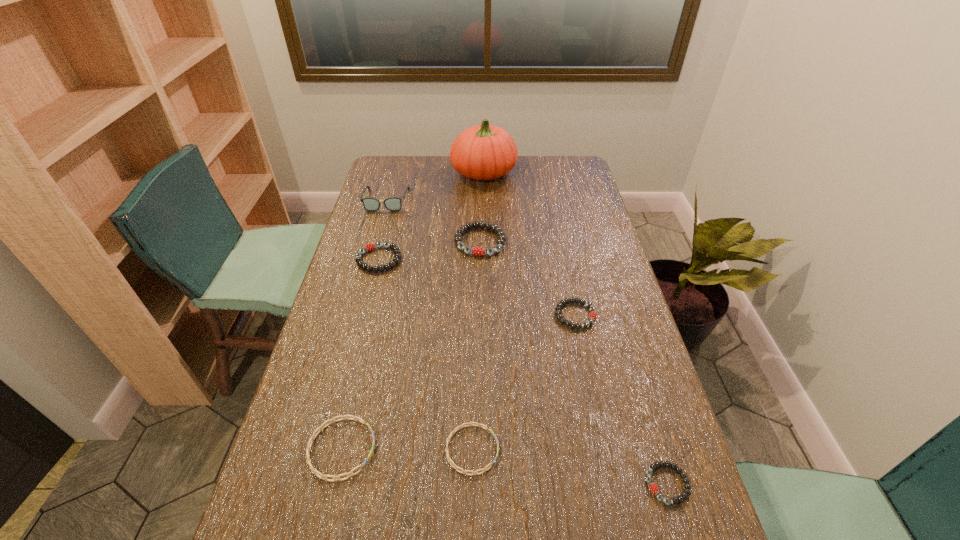
This screenshot has height=540, width=960. Find the location of `vacant region located 0.250m on the surface of the right blue bracelet showing star-shaped elements`. vacant region located 0.250m on the surface of the right blue bracelet showing star-shaped elements is located at coordinates pyautogui.click(x=611, y=449).

Image resolution: width=960 pixels, height=540 pixels. Find the location of `free location located on the left of the smallest black bracelet`. free location located on the left of the smallest black bracelet is located at coordinates coord(517,484).

Find the location of a particular element. object present at the far edge is located at coordinates (483, 152).

Where is `spectacles that is at the left edge`? Image resolution: width=960 pixels, height=540 pixels. spectacles that is at the left edge is located at coordinates (370, 204).

The image size is (960, 540). I want to click on free space at the far edge, so click(x=517, y=170).

This screenshot has height=540, width=960. Find the location of `free space at the left edge of the desktop`. free space at the left edge of the desktop is located at coordinates (385, 257).

This screenshot has width=960, height=540. Find the location of `vacant space at the right edge of the desktop`. vacant space at the right edge of the desktop is located at coordinates (558, 188).

The width and height of the screenshot is (960, 540). Identify the location of empty location between the bigger blue bracelet and the spectacles. (364, 325).

Locate an element on the screen. This screenshot has width=960, height=540. vacant area that lies between the left blue bracelet and the tallest bracelet is located at coordinates (411, 345).

Locate an element on the screen. The image size is (960, 540). blank region between the biggest black bracelet and the bigger blue bracelet is located at coordinates (411, 345).